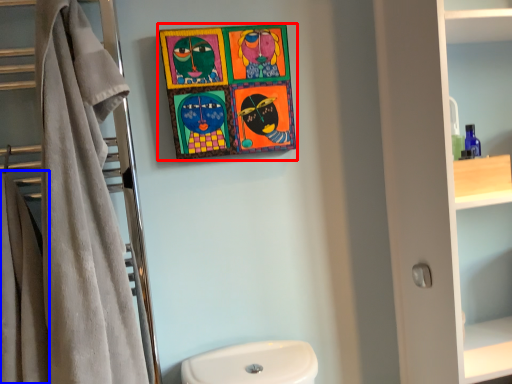
Question: Which of the following is the closest to the observer, picture frame (highlighted by a red box) or bath towel (highlighted by a blue box)?

Choices:
 (A) picture frame
 (B) bath towel

Answer: (B)